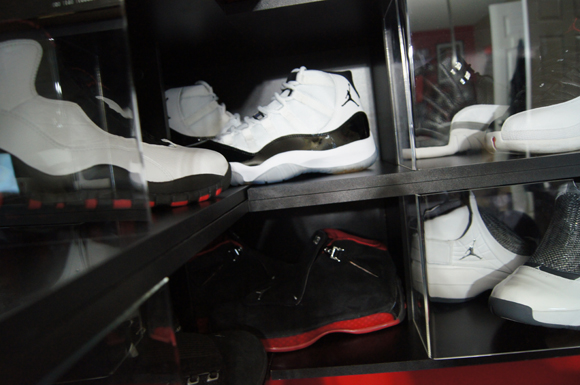
This screenshot has height=385, width=580. I want to click on red wall, so click(514, 376).